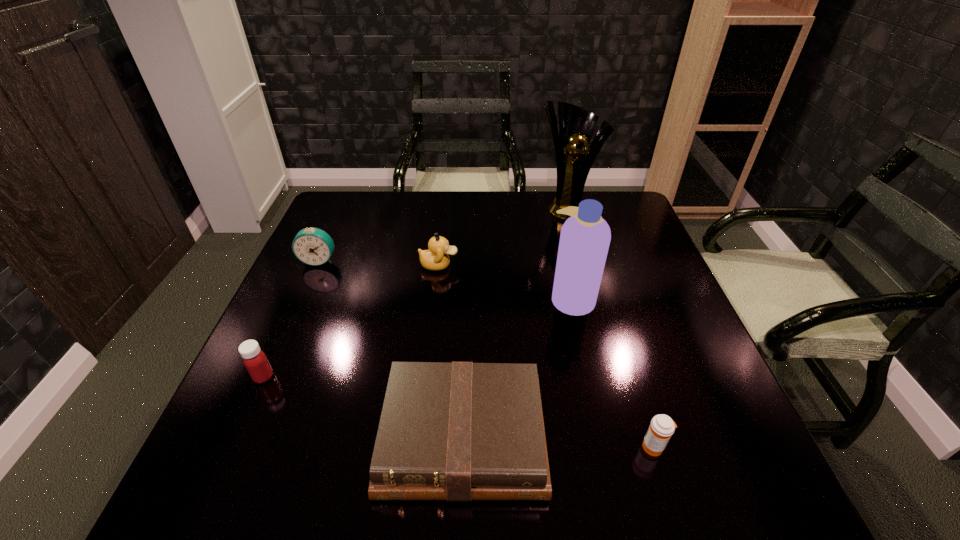
Identify the location of medicine that is at the right edge. The width and height of the screenshot is (960, 540). (662, 427).

The height and width of the screenshot is (540, 960). Find the location of `object that is at the far right corner`. object that is at the far right corner is located at coordinates (576, 125).

This screenshot has width=960, height=540. Identify the location of object located in the near right corner section of the desktop. (662, 427).

This screenshot has height=540, width=960. I want to click on free space at the far edge, so click(x=516, y=200).

The height and width of the screenshot is (540, 960). I want to click on free space at the left edge, so click(x=347, y=255).

Find the location of a particular element. blank space at the right edge is located at coordinates (614, 304).

Find the location of a particular element. vacant area at the far left corner of the desktop is located at coordinates (370, 192).

In order to click on vacant space at the near left corner of the desktop in this screenshot , I will do `click(233, 472)`.

This screenshot has height=540, width=960. In order to click on free region at the far right corner in this screenshot , I will do pos(617,208).

The height and width of the screenshot is (540, 960). I want to click on blank space at the near right corner of the desktop, so click(x=752, y=472).